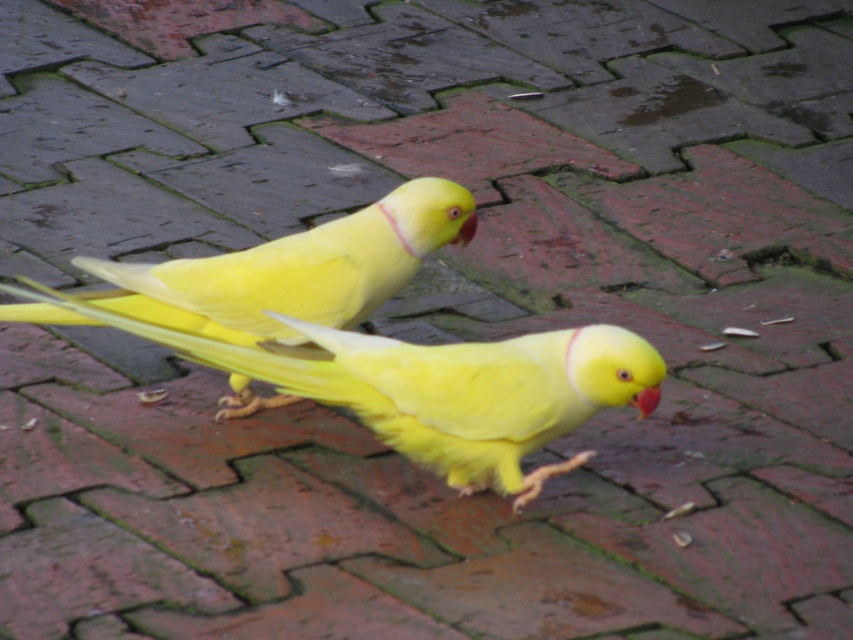
You are a birdwatcher trying to identify the species of the yellow matte canary at center and the red matte beak at center in the image. Which one has a greater height?

The yellow matte canary at center is much taller than the red matte beak at center.

You are a birdwatcher trying to identify the species of the yellow matte canary at center and the red matte beak at center in the image. Based on their size, which one is more likely to be the actual bird?

The yellow matte canary at center is larger in size than the red matte beak at center, so the yellow matte canary at center is more likely to be the actual bird since birds are typically larger than their beaks.

You are a birdwatcher observing two yellow birds in the image. You notice a yellow matte canary at center and a yellow matte beak at center. Which one is positioned to the left?

The yellow matte canary at center is to the left of the yellow matte beak at center.